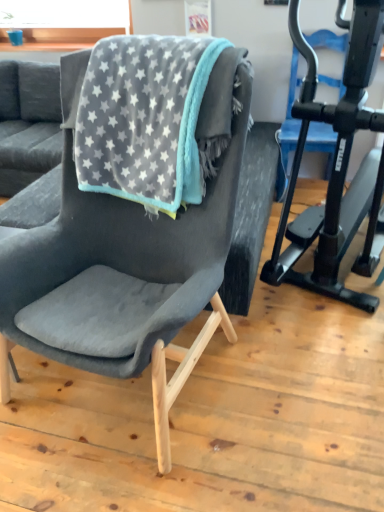
Question: Considering the relative sizes of black matte stationary bicycle at right and velvet grey blanket with star pattern at center in the image provided, is black matte stationary bicycle at right shorter than velvet grey blanket with star pattern at center?

Choices:
 (A) yes
 (B) no

Answer: (B)

Question: Is black matte stationary bicycle at right at the left side of velvet grey blanket with star pattern at center?

Choices:
 (A) yes
 (B) no

Answer: (B)

Question: Is black matte stationary bicycle at right not inside velvet grey blanket with star pattern at center?

Choices:
 (A) yes
 (B) no

Answer: (A)

Question: Is black matte stationary bicycle at right aimed at velvet grey blanket with star pattern at center?

Choices:
 (A) no
 (B) yes

Answer: (A)

Question: From a real-world perspective, is black matte stationary bicycle at right located higher than velvet grey blanket with star pattern at center?

Choices:
 (A) no
 (B) yes

Answer: (A)

Question: From a real-world perspective, is black matte stationary bicycle at right above or below velvet dark gray chair at center?

Choices:
 (A) above
 (B) below

Answer: (A)

Question: Is black matte stationary bicycle at right wider or thinner than velvet dark gray chair at center?

Choices:
 (A) thin
 (B) wide

Answer: (B)

Question: Based on their sizes in the image, would you say black matte stationary bicycle at right is bigger or smaller than velvet dark gray chair at center?

Choices:
 (A) big
 (B) small

Answer: (A)

Question: Is black matte stationary bicycle at right taller or shorter than velvet dark gray chair at center?

Choices:
 (A) short
 (B) tall

Answer: (B)

Question: In terms of width, does velvet dark gray chair at center look wider or thinner when compared to black matte stationary bicycle at right?

Choices:
 (A) wide
 (B) thin

Answer: (B)

Question: Considering the positions of velvet dark gray chair at center and black matte stationary bicycle at right in the image, is velvet dark gray chair at center bigger or smaller than black matte stationary bicycle at right?

Choices:
 (A) small
 (B) big

Answer: (A)

Question: From their relative heights in the image, would you say velvet dark gray chair at center is taller or shorter than black matte stationary bicycle at right?

Choices:
 (A) short
 (B) tall

Answer: (A)

Question: From the image's perspective, relative to black matte stationary bicycle at right, is velvet dark gray chair at center above or below?

Choices:
 (A) below
 (B) above

Answer: (A)

Question: Is black matte stationary bicycle at right wider or thinner than velvet grey blanket with star pattern at center?

Choices:
 (A) thin
 (B) wide

Answer: (B)

Question: Is point (349, 216) positioned closer to the camera than point (99, 161)?

Choices:
 (A) farther
 (B) closer

Answer: (A)